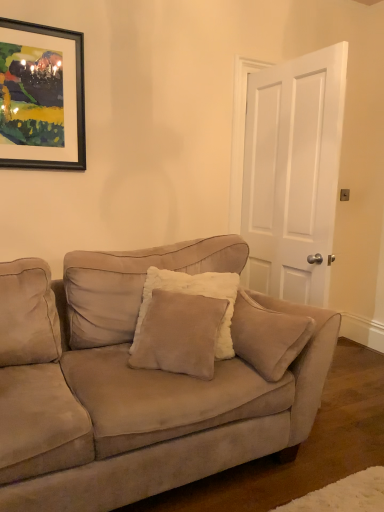
Question: Is suede couch at center shorter than white matte door at center?

Choices:
 (A) yes
 (B) no

Answer: (A)

Question: From the image's perspective, is suede couch at center beneath white matte door at center?

Choices:
 (A) no
 (B) yes

Answer: (B)

Question: Is suede couch at center turned away from white matte door at center?

Choices:
 (A) yes
 (B) no

Answer: (B)

Question: Does suede couch at center have a greater width compared to white matte door at center?

Choices:
 (A) yes
 (B) no

Answer: (A)

Question: Is suede couch at center smaller than white matte door at center?

Choices:
 (A) no
 (B) yes

Answer: (A)

Question: From the image's perspective, is suede couch at center over white matte door at center?

Choices:
 (A) yes
 (B) no

Answer: (B)

Question: From a real-world perspective, is white matte door at center under suede couch at center?

Choices:
 (A) no
 (B) yes

Answer: (A)

Question: From the image's perspective, does white matte door at center appear lower than suede couch at center?

Choices:
 (A) yes
 (B) no

Answer: (B)

Question: Is white matte door at center bigger than suede couch at center?

Choices:
 (A) no
 (B) yes

Answer: (A)

Question: Is white matte door at center outside of suede couch at center?

Choices:
 (A) no
 (B) yes

Answer: (B)

Question: Is white matte door at center positioned with its back to suede couch at center?

Choices:
 (A) no
 (B) yes

Answer: (B)

Question: Is white matte door at center shorter than suede couch at center?

Choices:
 (A) yes
 (B) no

Answer: (B)

Question: Considering the relative sizes of black matte picture frame at upper left and white matte door at center in the image provided, is black matte picture frame at upper left shorter than white matte door at center?

Choices:
 (A) no
 (B) yes

Answer: (B)